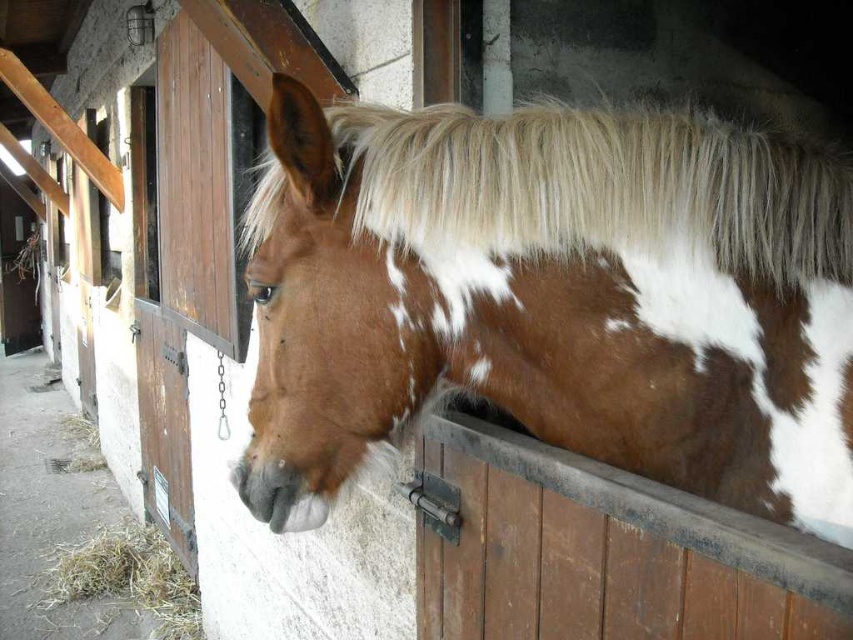
Is brown speckled fur at center thinner than white silky mane at upper center?

Incorrect, brown speckled fur at center's width is not less than white silky mane at upper center's.

Does brown speckled fur at center have a lesser height compared to white silky mane at upper center?

In fact, brown speckled fur at center may be taller than white silky mane at upper center.

Where is `brown speckled fur at center`? This screenshot has width=853, height=640. brown speckled fur at center is located at coordinates (553, 298).

Is brown speckled fur at center closer to camera compared to brown matte nose at center?

Yes, it is in front of brown matte nose at center.

Which is above, brown speckled fur at center or brown matte nose at center?

brown speckled fur at center is higher up.

Does point (608, 180) come in front of point (251, 368)?

Yes, it is in front of point (251, 368).

Find the location of `brown speckled fur at center`. brown speckled fur at center is located at coordinates pyautogui.click(x=553, y=298).

Who is lower down, yellow dry hay at lower left or brown matte nose at center?

Positioned lower is yellow dry hay at lower left.

Between yellow dry hay at lower left and brown matte nose at center, which one appears on the right side from the viewer's perspective?

From the viewer's perspective, brown matte nose at center appears more on the right side.

Who is more distant from viewer, (x=114, y=588) or (x=253, y=376)?

Point (x=114, y=588)

Locate an element on the screen. This screenshot has height=640, width=853. yellow dry hay at lower left is located at coordinates (129, 577).